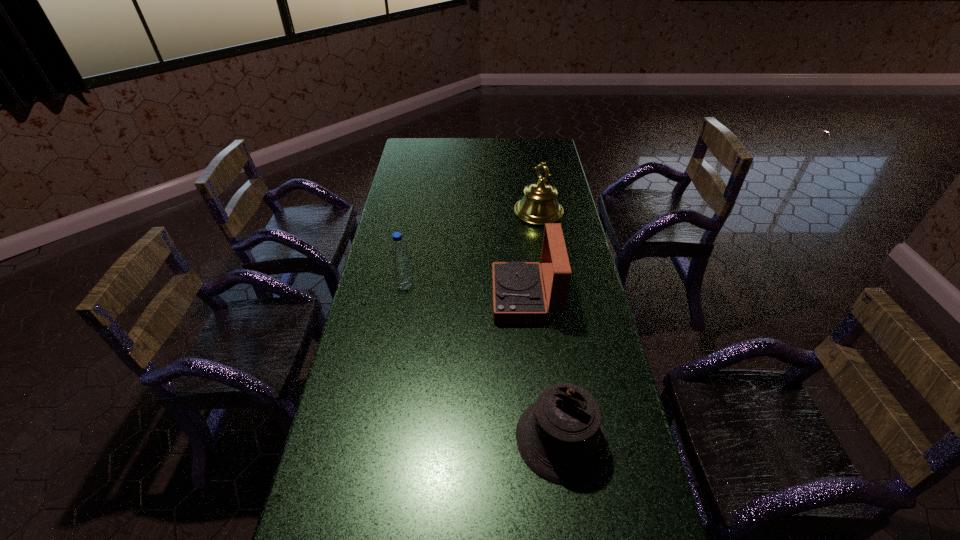
This screenshot has width=960, height=540. In order to click on vacant region between the phonograph record and the nearest object in this screenshot , I will do `click(543, 368)`.

You are a GUI agent. You are given a task and a screenshot of the screen. Output one action in this format:
    pyautogui.click(x=<x>, y=<y>)
    Task: Click on the vacant area that lies between the phonograph record and the nearer bell
    This screenshot has width=960, height=540.
    Given the screenshot: What is the action you would take?
    pyautogui.click(x=543, y=368)

Identify the location of free point between the leftmost object and the farther bell. The image size is (960, 540). (471, 249).

I want to click on unoccupied area between the phonograph record and the water bottle, so click(465, 292).

At what (x,y) coordinates should I click in order to perform the action: click on empty space between the water bottle and the farther bell. Please return your answer as a coordinate pair (x, y). Looking at the image, I should click on click(x=471, y=249).

Locate an element on the screen. the second closest object relative to the phonograph record is located at coordinates (399, 252).

Identify the location of object that is the second closest to the water bottle. The image size is (960, 540). (539, 205).

Locate an element on the screen. This screenshot has width=960, height=540. free space that satisfies the following two spatial constraints: 1. on the face of the phonograph record; 2. on the back side of the nearer bell is located at coordinates (540, 438).

You are a GUI agent. You are given a task and a screenshot of the screen. Output one action in this format:
    pyautogui.click(x=<x>, y=<y>)
    Task: Click on the vacant region that satisfies the following two spatial constraints: 1. on the face of the phonograph record; 2. on the back side of the nearest object
    The image size is (960, 540).
    Given the screenshot: What is the action you would take?
    pyautogui.click(x=540, y=438)

I want to click on vacant point that satisfies the following two spatial constraints: 1. on the face of the phonograph record; 2. on the back side of the nearest object, so click(540, 438).